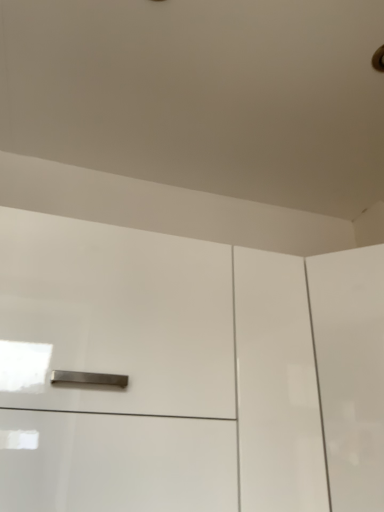
Question: Is glossy white cabinet at center taller or shorter than white glossy cabinet at right?

Choices:
 (A) short
 (B) tall

Answer: (B)

Question: From a real-world perspective, relative to white glossy cabinet at right, is glossy white cabinet at center vertically above or below?

Choices:
 (A) below
 (B) above

Answer: (B)

Question: Is point (39, 326) closer or farther from the camera than point (339, 460)?

Choices:
 (A) closer
 (B) farther

Answer: (A)

Question: From a real-world perspective, is white glossy cabinet at right positioned above or below glossy white cabinet at center?

Choices:
 (A) below
 (B) above

Answer: (A)

Question: Is white glossy cabinet at right in front of or behind glossy white cabinet at center in the image?

Choices:
 (A) front
 (B) behind

Answer: (B)

Question: Does point (367, 340) appear closer or farther from the camera than point (175, 324)?

Choices:
 (A) farther
 (B) closer

Answer: (A)

Question: Looking at their shapes, would you say white glossy cabinet at right is wider or thinner than glossy white cabinet at center?

Choices:
 (A) thin
 (B) wide

Answer: (B)